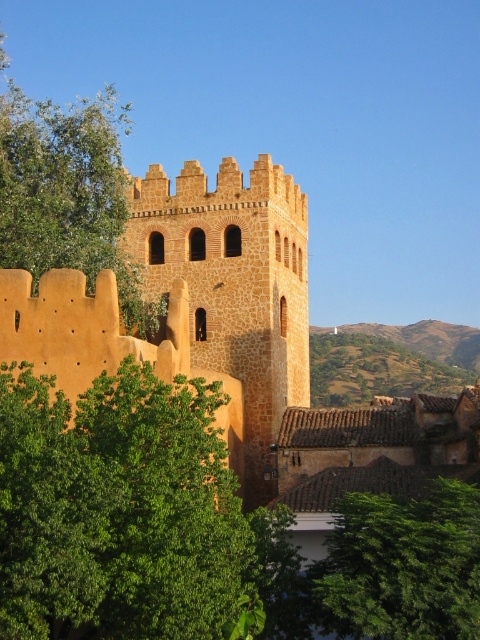
What are the coordinates of `green leafy tree at lower left` in the screenshot? It's located at (120, 513).

Does green leafy tree at lower left appear on the left side of golden stone tower at center?

Correct, you'll find green leafy tree at lower left to the left of golden stone tower at center.

Is point (243, 612) positioned in front of point (307, 356)?

Yes, it is.

At what (x,y) coordinates should I click in order to perform the action: click on green leafy tree at lower left. Please return your answer as a coordinate pair (x, y). The height and width of the screenshot is (640, 480). Looking at the image, I should click on (120, 513).

Does green leafy tree at lower left have a smaller size compared to green leafy tree at lower right?

No, green leafy tree at lower left is not smaller than green leafy tree at lower right.

Is point (82, 580) in front of point (477, 612)?

Yes, it is in front of point (477, 612).

What are the coordinates of `green leafy tree at lower left` in the screenshot? It's located at (120, 513).

Between green leafy tree at lower left and green leafy tree at upper left, which one is positioned lower?

green leafy tree at lower left

Between green leafy tree at lower left and green leafy tree at upper left, which one appears on the left side from the viewer's perspective?

green leafy tree at upper left is more to the left.

Is point (166, 557) positioned after point (57, 248)?

No, it is not.

At what (x,y) coordinates should I click in order to perform the action: click on green leafy tree at lower left. Please return your answer as a coordinate pair (x, y). This screenshot has width=480, height=640. Looking at the image, I should click on (120, 513).